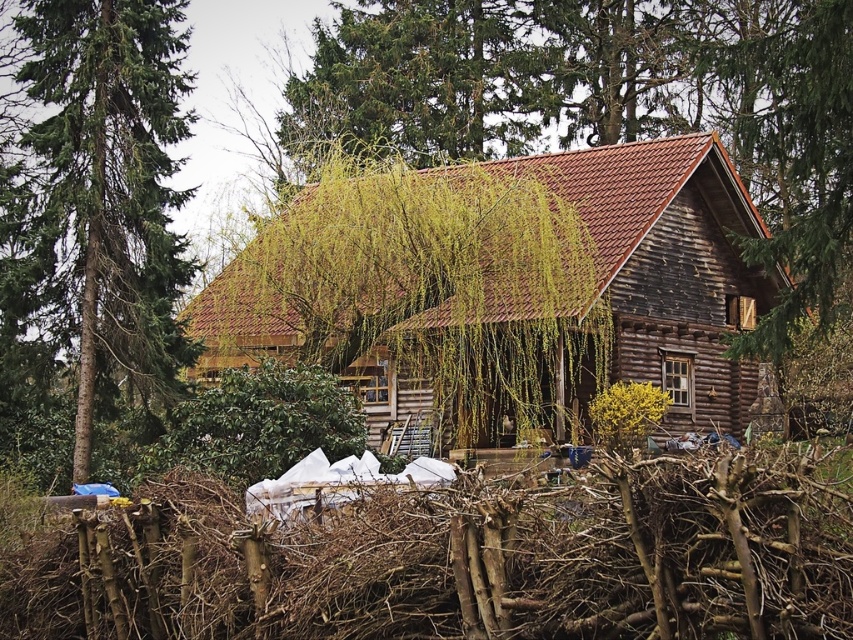
Question: Does brown wooden fence at lower center have a lesser width compared to weathered wood cabin at center?

Choices:
 (A) no
 (B) yes

Answer: (B)

Question: Can you confirm if weathered wood cabin at center is positioned above green coniferous tree at left?

Choices:
 (A) yes
 (B) no

Answer: (B)

Question: Which point appears farthest from the camera in this image?

Choices:
 (A) (44, 138)
 (B) (672, 196)

Answer: (B)

Question: Estimate the real-world distances between objects in this image. Which object is farther from the brown wooden fence at lower center?

Choices:
 (A) weathered wood cabin at center
 (B) green coniferous tree at left

Answer: (A)

Question: Considering the relative positions of brown wooden fence at lower center and green coniferous tree at left in the image provided, where is brown wooden fence at lower center located with respect to green coniferous tree at left?

Choices:
 (A) left
 (B) right

Answer: (B)

Question: Among these objects, which one is farthest from the camera?

Choices:
 (A) green coniferous tree at left
 (B) brown wooden fence at lower center

Answer: (A)